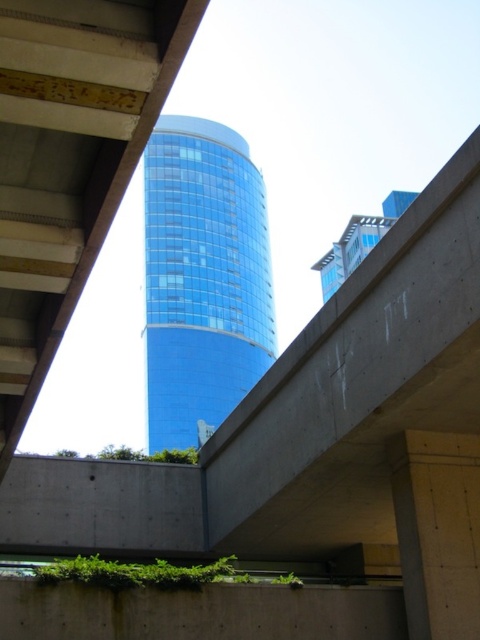
Question: Can you confirm if blue glassy tower at center is positioned above concrete at center?

Choices:
 (A) yes
 (B) no

Answer: (A)

Question: Which object appears closest to the camera in this image?

Choices:
 (A) concrete at center
 (B) blue glassy tower at center

Answer: (A)

Question: Does blue glassy tower at center have a lesser width compared to concrete at center?

Choices:
 (A) yes
 (B) no

Answer: (B)

Question: Among these objects, which one is nearest to the camera?

Choices:
 (A) blue glassy tower at center
 (B) concrete at center

Answer: (B)

Question: Among these objects, which one is farthest from the camera?

Choices:
 (A) concrete at center
 (B) blue glassy tower at center

Answer: (B)

Question: Is blue glassy tower at center to the right of concrete at center from the viewer's perspective?

Choices:
 (A) no
 (B) yes

Answer: (A)